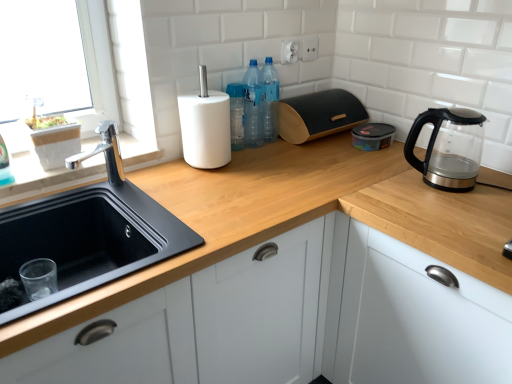
I want to click on vacant space situated above white matte cabinet at lower right (from a real-world perspective), so click(x=459, y=202).